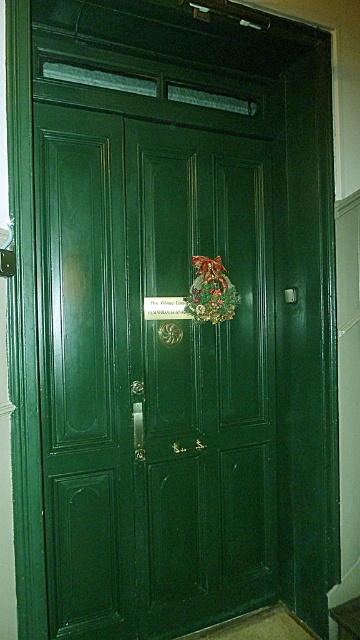
Question: Which object is closer to the camera taking this photo?

Choices:
 (A) green fabric wreath at center
 (B) green polished wood door at center

Answer: (B)

Question: Does green polished wood door at center have a lesser width compared to green fabric wreath at center?

Choices:
 (A) no
 (B) yes

Answer: (A)

Question: Observing the image, what is the correct spatial positioning of green polished wood door at center in reference to green fabric wreath at center?

Choices:
 (A) below
 (B) above

Answer: (A)

Question: Which of the following is the closest to the observer?

Choices:
 (A) green polished wood door at center
 (B) green fabric wreath at center

Answer: (A)

Question: Which of the following is the farthest from the observer?

Choices:
 (A) green fabric wreath at center
 (B) green polished wood door at center

Answer: (A)

Question: Is green polished wood door at center above green fabric wreath at center?

Choices:
 (A) yes
 (B) no

Answer: (B)